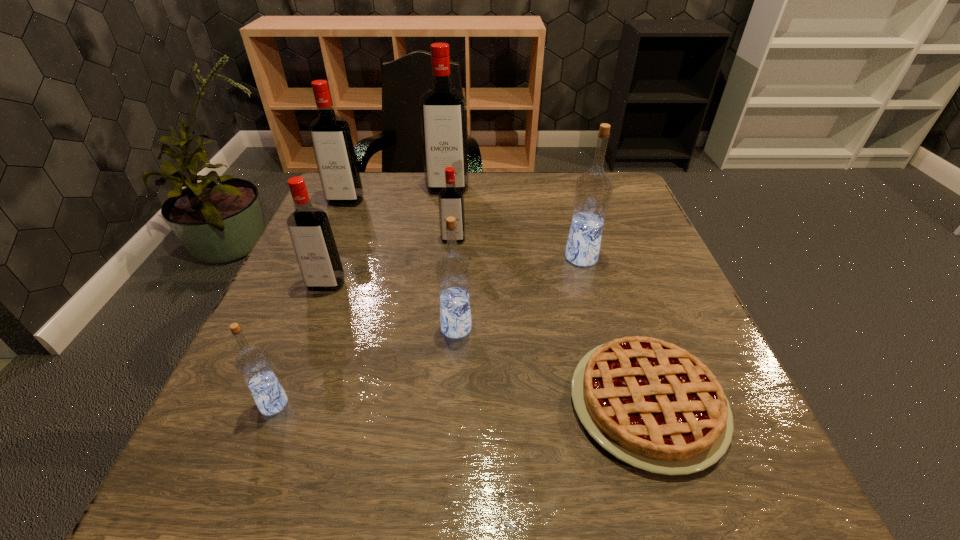
Identify the location of the tallest object. (443, 111).

The width and height of the screenshot is (960, 540). Find the location of `the biggest red vodka`. the biggest red vodka is located at coordinates (443, 111).

This screenshot has height=540, width=960. Identify the location of the third smallest red vodka. (330, 134).

Locate an element on the screen. the farthest blue vodka is located at coordinates (593, 190).

Identify the location of the rightmost blue vodka. (593, 190).

Where is `the second nearest blue vodka`? This screenshot has width=960, height=540. the second nearest blue vodka is located at coordinates (453, 271).

Locate an element on the screen. the third nearest object is located at coordinates (453, 271).

I want to click on the fifth farthest vodka, so click(309, 227).

Where is `the nearest red vodka`? Image resolution: width=960 pixels, height=540 pixels. the nearest red vodka is located at coordinates (309, 227).

The width and height of the screenshot is (960, 540). I want to click on the sixth nearest object, so click(450, 199).